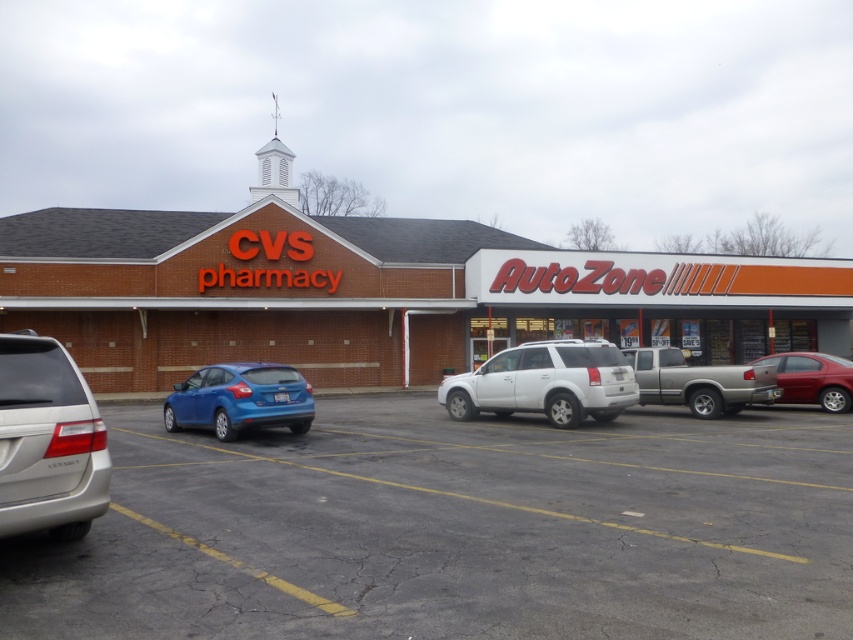
You are standing at the entrance of the CVS Pharmacy and want to locate the AutoZone store. If you walk straight ahead, will you reach the AutoZone store before reaching the point at coordinates (x=479, y=388)?

The point at coordinates (x=479, y=388) is 53.57 feet away from the camera. Since the AutoZone store is to the right of the CVS Pharmacy, walking straight ahead would not lead you to AutoZone before reaching the point. Therefore, you will reach the point before AutoZone.